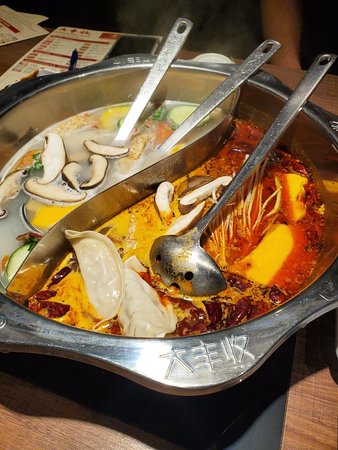
Where is `spoon`? spoon is located at coordinates (149, 83).